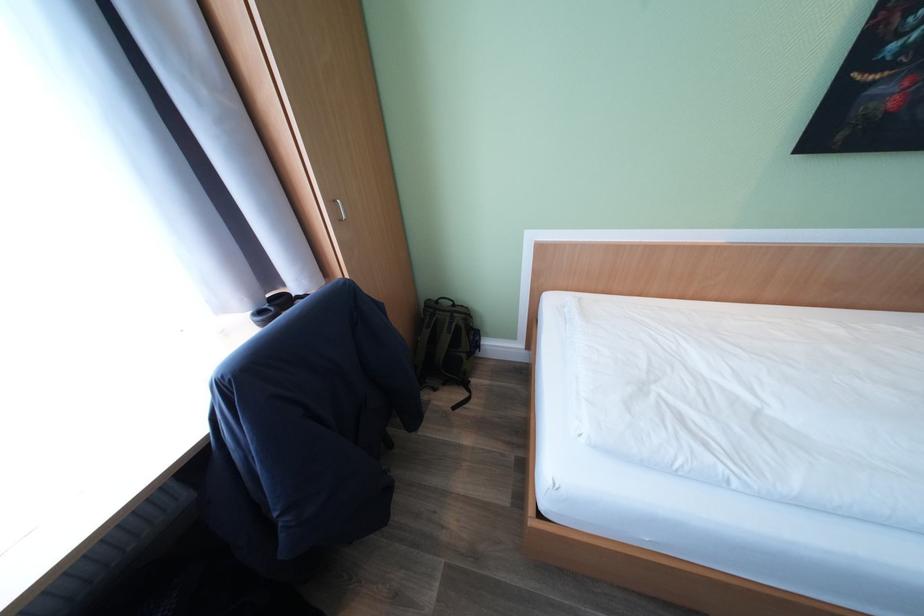
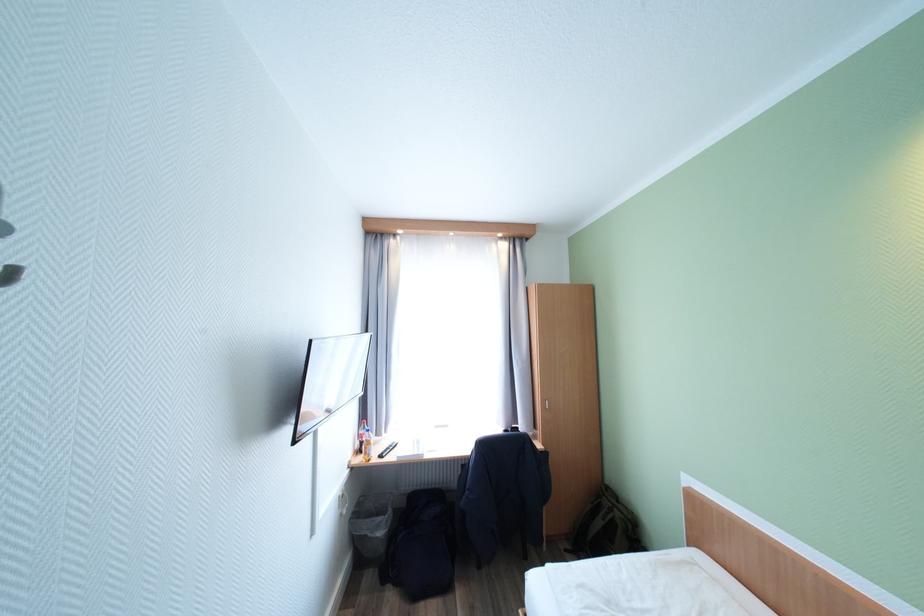
Find the pixel in the second image that matches pixel 211 434 in the first image.

(477, 455)